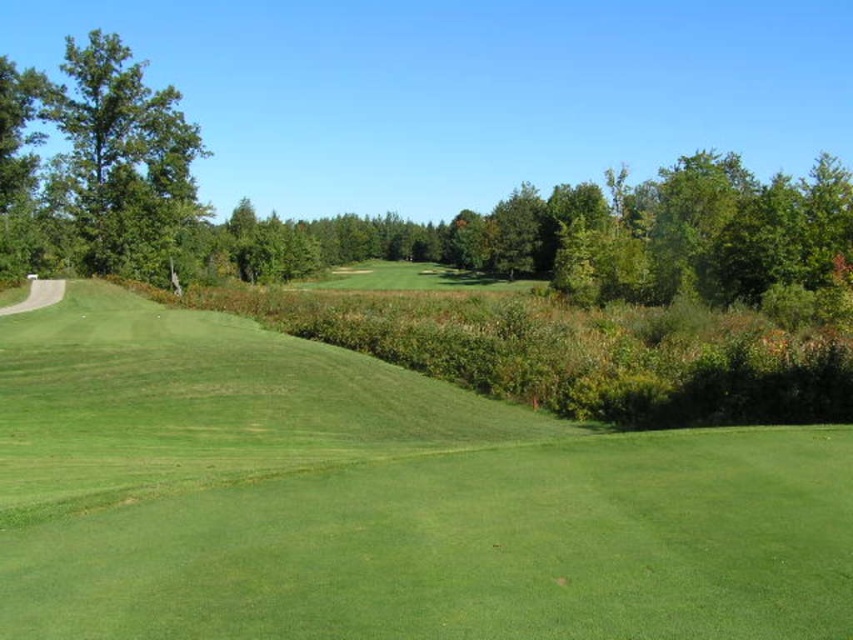
Based on the photo, you are a golfer standing on the green grass at center. You want to hit a ball to the green leafy tree at left. Considering the height difference between the two, will the ball need to be hit upwards or downwards to reach the tree?

The green grass at center is shorter than the green leafy tree at left, so the ball needs to be hit upwards to reach the tree.

You are a golfer standing on the green grass at center. You want to hit a ball to the green leafy tree at left. Considering the space they occupy, which direction should you aim to ensure the ball lands closer to the tree?

The green leafy tree at left occupies more space than the green grass at center. Aim towards the larger area occupied by the green leafy tree at left to ensure the ball lands closer to it.

Looking at this image, you are a golfer standing at the tee box and want to hit your ball to the green grass at center. Based on the coordinates provided, in which direction should you aim your shot relative to the current position?

The green grass at center is located at coordinates point (379, 499), so you should aim towards the center of the fairway where the green grass is situated.